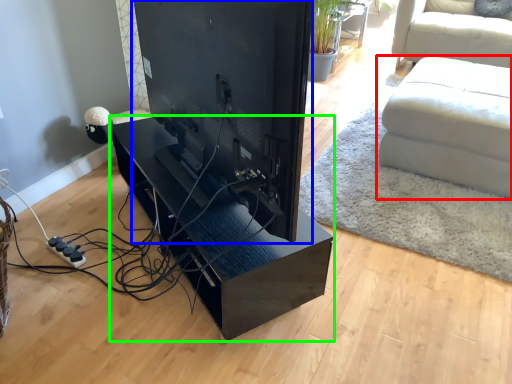
Question: Considering the real-world distances, which object is farthest from studio couch (highlighted by a red box)? desktop computer (highlighted by a blue box) or table (highlighted by a green box)?

Choices:
 (A) desktop computer
 (B) table

Answer: (A)